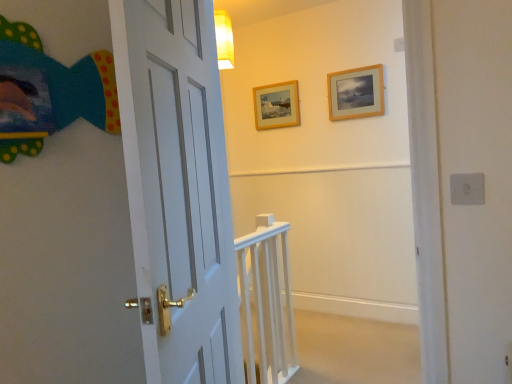
Question: Can you confirm if wooden picture frame at upper center, the second picture frame viewed from the right, is taller than wooden picture frame at upper center, marked as the first picture frame in a front-to-back arrangement?

Choices:
 (A) no
 (B) yes

Answer: (A)

Question: From a real-world perspective, does wooden picture frame at upper center, the second picture frame viewed from the right, stand above wooden picture frame at upper center, positioned as the second picture frame in back-to-front order?

Choices:
 (A) no
 (B) yes

Answer: (A)

Question: Is wooden picture frame at upper center, arranged as the first picture frame when viewed from the back, wider than wooden picture frame at upper center, which appears as the second picture frame when viewed from the left?

Choices:
 (A) yes
 (B) no

Answer: (B)

Question: Considering the relative sizes of wooden picture frame at upper center, which is the 1th picture frame in left-to-right order, and wooden picture frame at upper center, marked as the first picture frame in a front-to-back arrangement, in the image provided, is wooden picture frame at upper center, which is the 1th picture frame in left-to-right order, smaller than wooden picture frame at upper center, marked as the first picture frame in a front-to-back arrangement,?

Choices:
 (A) yes
 (B) no

Answer: (A)

Question: Could you tell me if wooden picture frame at upper center, which is the 1th picture frame in left-to-right order, is facing wooden picture frame at upper center, marked as the first picture frame in a front-to-back arrangement?

Choices:
 (A) yes
 (B) no

Answer: (B)

Question: From a real-world perspective, is wooden picture frame at upper center, arranged as the first picture frame when viewed from the back, located beneath wooden picture frame at upper center, which is the 1th picture frame from right to left?

Choices:
 (A) no
 (B) yes

Answer: (B)

Question: From a real-world perspective, is wooden picture frame at upper center, marked as the first picture frame in a front-to-back arrangement, on top of wooden picture frame at upper center, the second picture frame viewed from the right?

Choices:
 (A) no
 (B) yes

Answer: (B)

Question: Is wooden picture frame at upper center, which is the 1th picture frame from right to left, aimed at wooden picture frame at upper center, arranged as the first picture frame when viewed from the back?

Choices:
 (A) yes
 (B) no

Answer: (B)

Question: Is wooden picture frame at upper center, marked as the first picture frame in a front-to-back arrangement, outside of wooden picture frame at upper center, arranged as the first picture frame when viewed from the back?

Choices:
 (A) yes
 (B) no

Answer: (A)

Question: Does wooden picture frame at upper center, positioned as the second picture frame in back-to-front order, have a greater height compared to wooden picture frame at upper center, the second picture frame viewed from the right?

Choices:
 (A) no
 (B) yes

Answer: (B)

Question: From the image's perspective, is wooden picture frame at upper center, which is the 1th picture frame from right to left, beneath wooden picture frame at upper center, arranged as the first picture frame when viewed from the back?

Choices:
 (A) no
 (B) yes

Answer: (A)

Question: Does wooden picture frame at upper center, positioned as the second picture frame in back-to-front order, come behind wooden picture frame at upper center, the second picture frame viewed from the right?

Choices:
 (A) no
 (B) yes

Answer: (A)

Question: Is white wooden rail at center positioned in front of wooden picture frame at upper center, positioned as the 2th picture frame in front-to-back order?

Choices:
 (A) no
 (B) yes

Answer: (B)